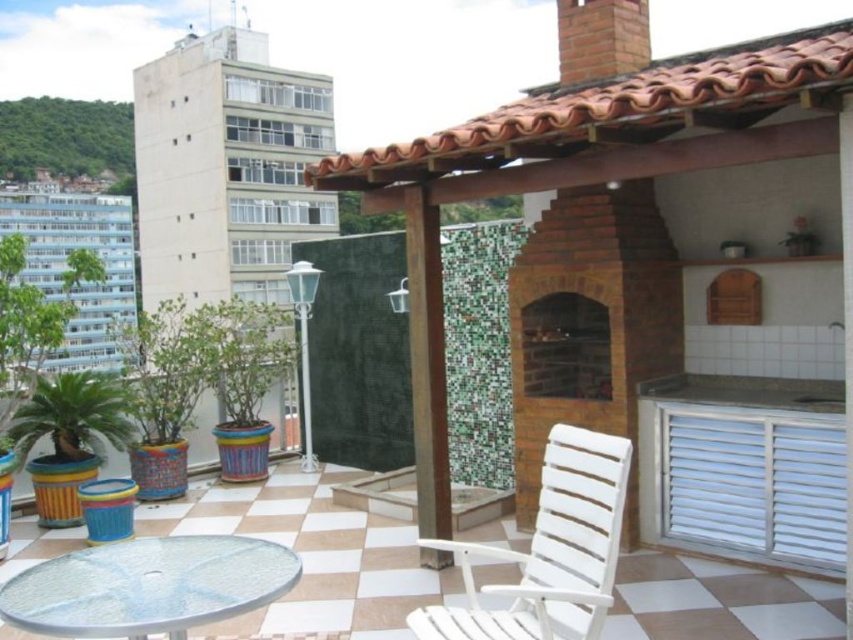
You are planning to set up a small table under the brown wood pillar at center for a rooftop dinner. However, there is already a white plastic chair at center. Is there enough space to place the table there without moving the chair?

The white plastic chair at center is positioned under the brown wood pillar at center, so placing a table there would require moving the chair to make space.

You are planning to place a new potted plant between the brick fireplace at center and the transparent glass table at lower left. Based on their positions, which object should the plant be closer to?

The plant should be closer to the transparent glass table at lower left because the brick fireplace at center is to the right of the transparent glass table at lower left, meaning the glass table is on the left side.

You are planning to host a small gathering on the rooftop terrace and want to ensure there is enough space for guests. You have a white plastic chair at center and a brown wood pillar at center. Which object takes up more floor space?

The white plastic chair at center is larger in size than the brown wood pillar at center, so it occupies more floor space.